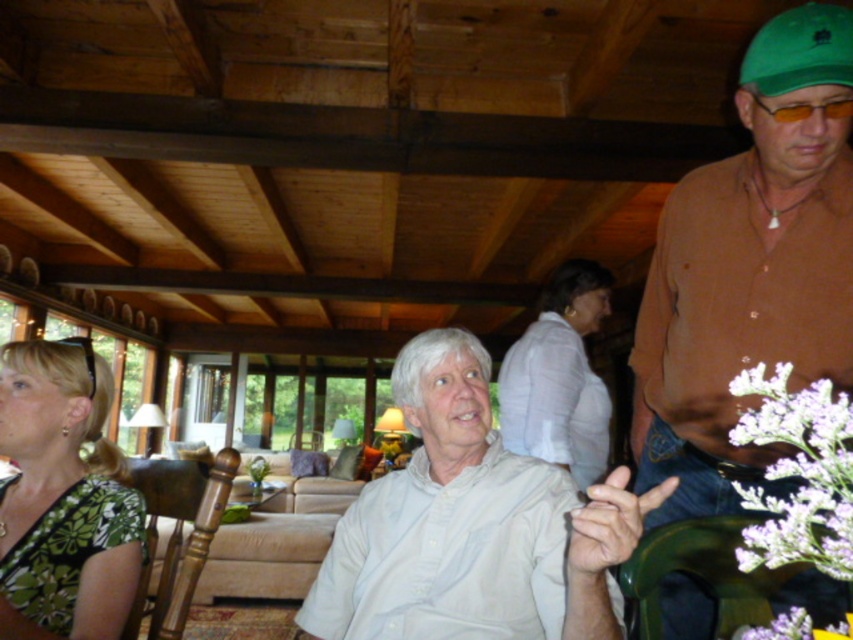
Question: Among these objects, which one is nearest to the camera?

Choices:
 (A) green floral dress at left
 (B) brown cotton shirt at center
 (C) purple fluffy flower at right
 (D) white cotton shirt at center

Answer: (C)

Question: Which point appears farthest from the camera in this image?

Choices:
 (A) (448, 460)
 (B) (576, 364)
 (C) (819, 294)

Answer: (B)

Question: Can you confirm if brown cotton shirt at center is positioned to the left of white textured blouse at center?

Choices:
 (A) yes
 (B) no

Answer: (B)

Question: Does green floral dress at left appear over white textured blouse at center?

Choices:
 (A) no
 (B) yes

Answer: (A)

Question: Can you confirm if brown cotton shirt at center is positioned to the left of white textured blouse at center?

Choices:
 (A) no
 (B) yes

Answer: (A)

Question: Which object appears farthest from the camera in this image?

Choices:
 (A) white textured blouse at center
 (B) green floral dress at left
 (C) purple fluffy flower at right
 (D) brown cotton shirt at center

Answer: (A)